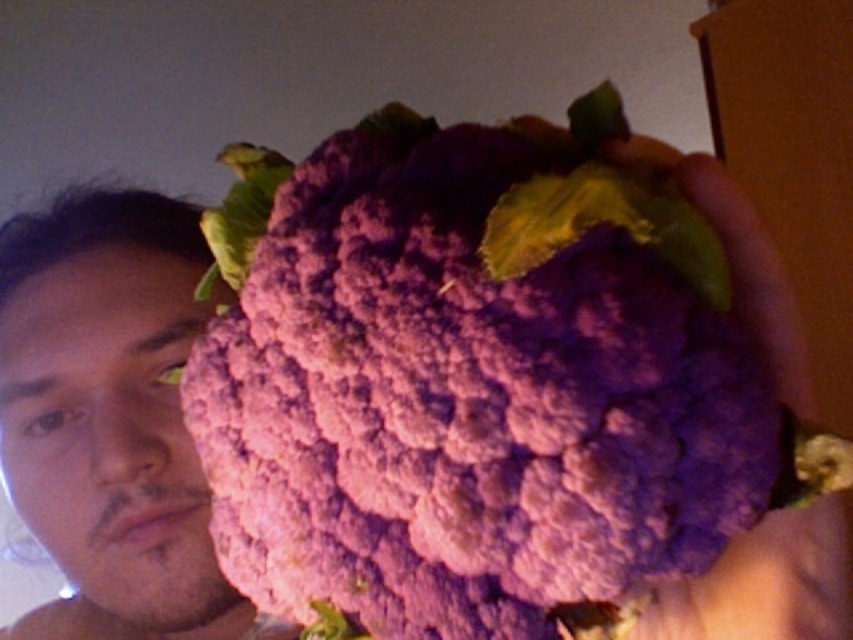
What do you see at coordinates (477, 385) in the screenshot? I see `purple matte broccoli at center` at bounding box center [477, 385].

Between point (358, 548) and point (100, 448), which one is positioned behind?

The point (100, 448) is more distant.

Locate an element on the screen. purple matte broccoli at center is located at coordinates (477, 385).

Is purple matte broccoli at center smaller than purple fabric hand at center?

Incorrect, purple matte broccoli at center is not smaller in size than purple fabric hand at center.

You are a GUI agent. You are given a task and a screenshot of the screen. Output one action in this format:
    pyautogui.click(x=<x>, y=<y>)
    Task: Click on the purple matte broccoli at center
    This screenshot has height=640, width=853.
    Given the screenshot: What is the action you would take?
    pyautogui.click(x=477, y=385)

Is smooth skin face at left closer to camera compared to purple fabric hand at center?

No, it is behind purple fabric hand at center.

Between smooth skin face at left and purple fabric hand at center, which one appears on the left side from the viewer's perspective?

smooth skin face at left

Between point (42, 461) and point (751, 596), which one is positioned in front?

Point (751, 596) is more forward.

What are the coordinates of `smooth skin face at left` in the screenshot? It's located at (109, 433).